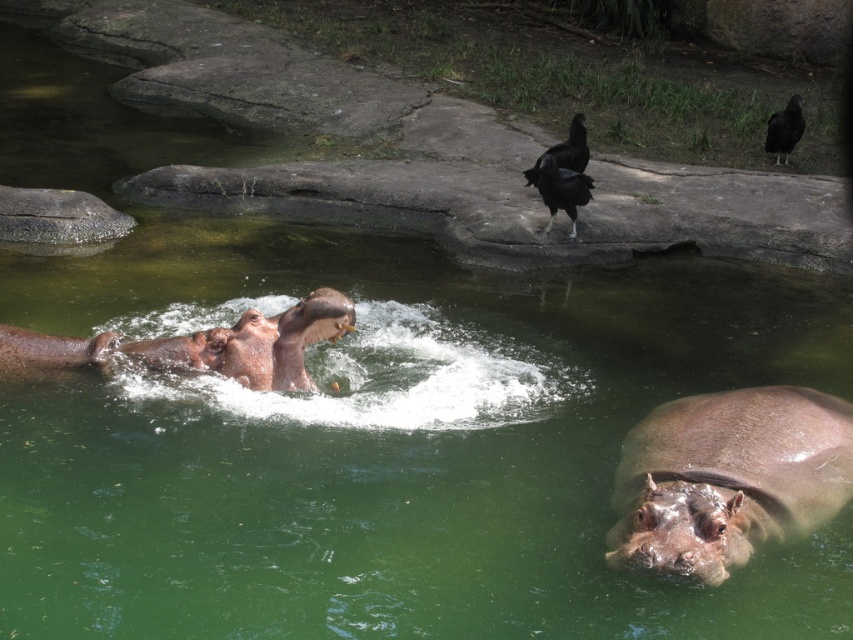
Question: Does brown matte hippo at center lie in front of gray rough rock at upper left?

Choices:
 (A) no
 (B) yes

Answer: (B)

Question: Which object is the farthest from the gray rough rock at upper left?

Choices:
 (A) black glossy bird at upper right
 (B) black glossy bird at upper center
 (C) smokey brown skin at center
 (D) brown matte hippo at center

Answer: (A)

Question: Which object is farther from the camera taking this photo?

Choices:
 (A) gray rough rock at upper left
 (B) black glossy bird at upper right
 (C) black glossy bird at upper center

Answer: (B)

Question: Which object is the farthest from the brown matte hippo at center?

Choices:
 (A) smokey brown skin at center
 (B) black glossy bird at upper center
 (C) black glossy bird at upper right
 (D) gray rough rock at upper left

Answer: (C)

Question: Can you confirm if smokey brown skin at center is wider than brown matte hippo at center?

Choices:
 (A) yes
 (B) no

Answer: (B)

Question: Where is brown matte hippo at center located in relation to gray rough rock at upper left in the image?

Choices:
 (A) left
 (B) right

Answer: (B)